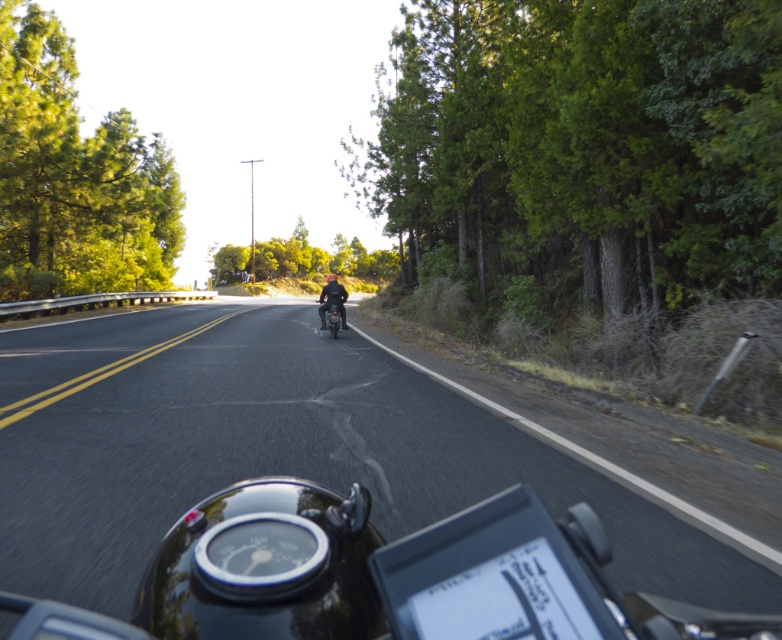
Question: Can you confirm if matte black motorcycle at center is bigger than shiny black motorcycle at center?

Choices:
 (A) yes
 (B) no

Answer: (A)

Question: Is green leafy tree at left to the left of green leafy tree at center from the viewer's perspective?

Choices:
 (A) no
 (B) yes

Answer: (B)

Question: Which object is positioned farthest from the green leafy tree at center?

Choices:
 (A) green leafy tree at left
 (B) black asphalt road at center
 (C) green leafy tree at right

Answer: (B)

Question: Does green leafy tree at center appear on the left side of shiny black motorcycle at center?

Choices:
 (A) no
 (B) yes

Answer: (B)

Question: Which of the following is the farthest from the observer?

Choices:
 (A) (323, 296)
 (B) (328, 317)

Answer: (A)

Question: Considering the real-world distances, which object is closest to the matte black motorcycle at center?

Choices:
 (A) green leafy tree at left
 (B) black asphalt road at center
 (C) shiny black motorcycle at center
 (D) green leafy tree at right

Answer: (C)